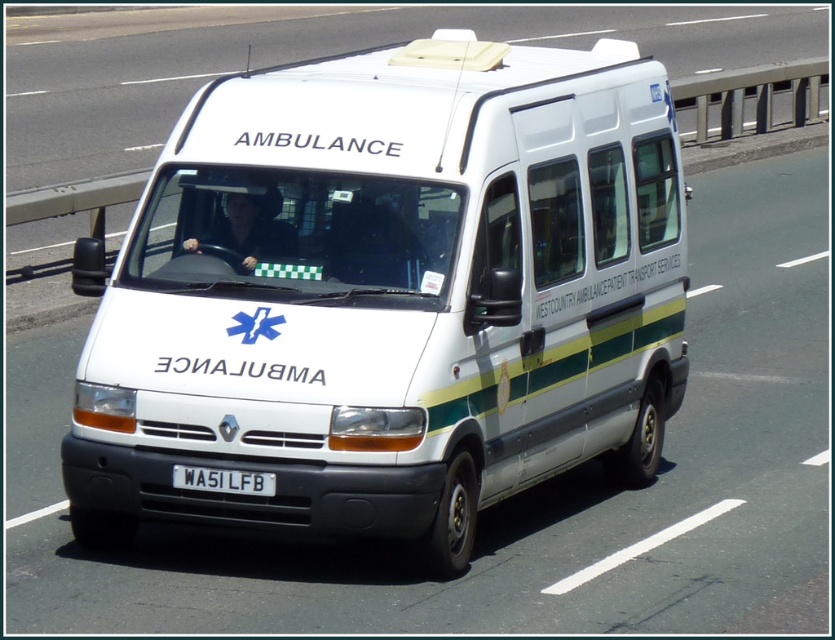
Can you confirm if white matte ambulance at center is bigger than white plastic license plate at center?

Yes.

Does point (633, 234) lie in front of point (205, 468)?

No, it is behind (205, 468).

Find the location of `white matte ambulance at center`. white matte ambulance at center is located at coordinates (388, 296).